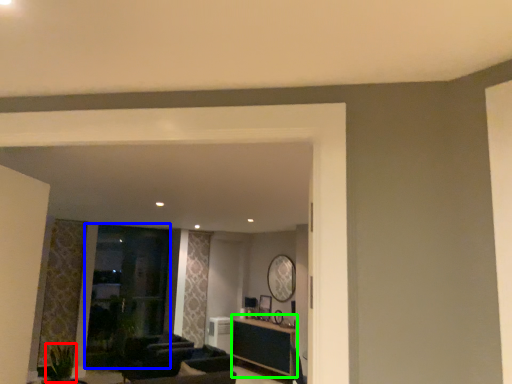
Question: Which object is the farthest from plant (highlighted by a red box)? Choose among these: glass door (highlighted by a blue box) or table (highlighted by a green box).

Choices:
 (A) glass door
 (B) table

Answer: (B)